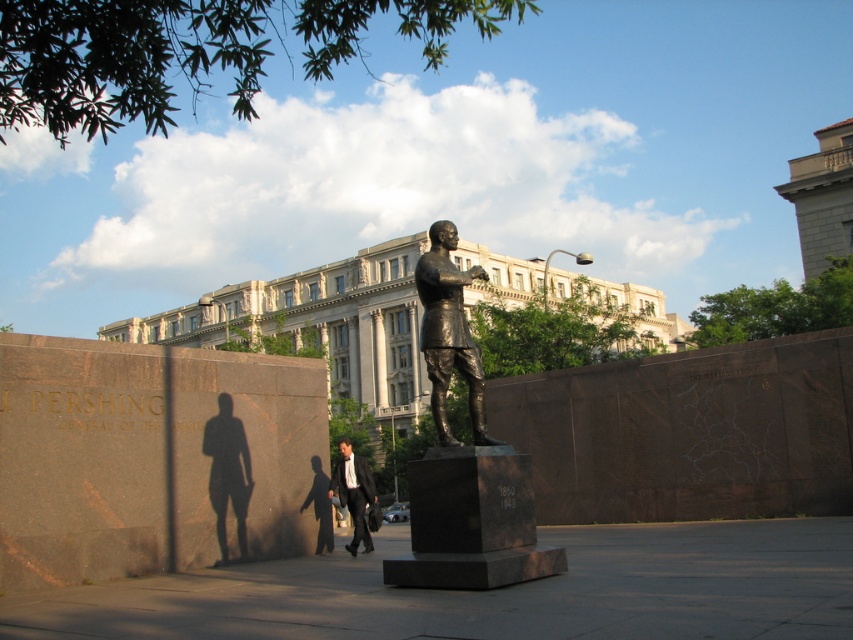
Question: Among these points, which one is farthest from the camera?

Choices:
 (A) (465, 572)
 (B) (351, 548)

Answer: (B)

Question: Is bronze statue at center positioned in front of black suit at center?

Choices:
 (A) no
 (B) yes

Answer: (B)

Question: Which object is positioned closest to the shiny bronze statue at center?

Choices:
 (A) bronze statue at center
 (B) black suit at center

Answer: (A)

Question: In this image, where is shiny bronze statue at center located relative to bronze statue at center?

Choices:
 (A) above
 (B) below

Answer: (B)

Question: Which of the following is the farthest from the observer?

Choices:
 (A) (474, 401)
 (B) (541, 560)

Answer: (A)

Question: Can you confirm if bronze statue at center is positioned to the right of black suit at center?

Choices:
 (A) yes
 (B) no

Answer: (A)